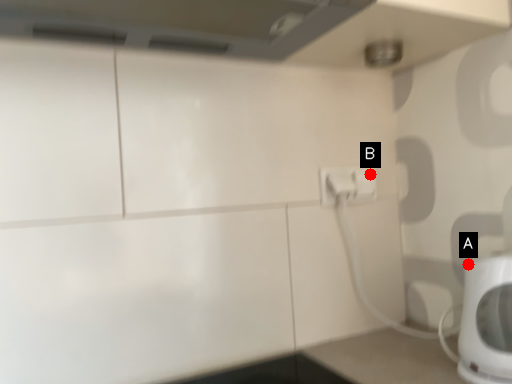
Question: Two points are circled on the image, labeled by A and B beside each circle. Which of the following is the closest to the observer?

Choices:
 (A) A is closer
 (B) B is closer

Answer: (A)